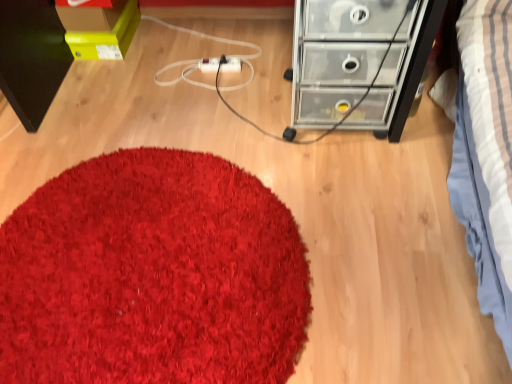
Find the location of a particular element. Image resolution: width=512 pixels, height=384 pixels. free space in front of transparent plastic chest of drawers at upper right is located at coordinates (362, 177).